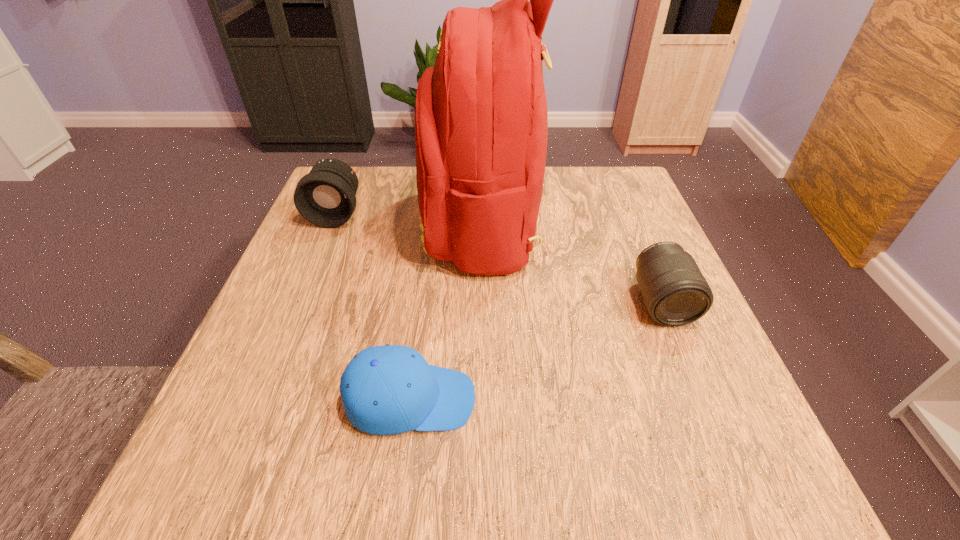
This screenshot has width=960, height=540. In the image, there is a desktop. In order to click on free space at the left edge in this screenshot , I will do `click(307, 318)`.

I want to click on vacant space at the right edge of the desktop, so click(608, 278).

At what (x,y) coordinates should I click in order to perform the action: click on vacant area at the far right corner of the desktop. Please return your answer as a coordinate pair (x, y). Looking at the image, I should click on (612, 185).

I want to click on free space at the near right corner, so click(751, 498).

This screenshot has width=960, height=540. I want to click on vacant space that is in between the backpack and the cap, so click(x=446, y=312).

Locate an element on the screen. unoccupied area between the cap and the third shortest object is located at coordinates (373, 306).

This screenshot has height=540, width=960. I want to click on free area in between the third shortest object and the nearest object, so click(x=373, y=306).

I want to click on free point between the tallest object and the cap, so click(x=446, y=312).

Where is `vacant area that lies between the tallest object and the second tallest object`? vacant area that lies between the tallest object and the second tallest object is located at coordinates (409, 219).

Where is `vacant point located between the tallest object and the nearer telephoto lens`? vacant point located between the tallest object and the nearer telephoto lens is located at coordinates (572, 263).